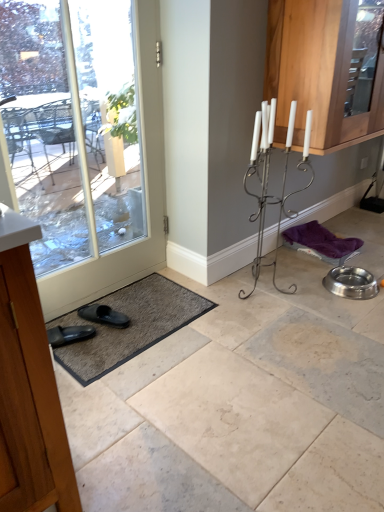
Identify the location of free spot to the right of metallic silver candle holder at center right. Image resolution: width=384 pixels, height=512 pixels. (309, 291).